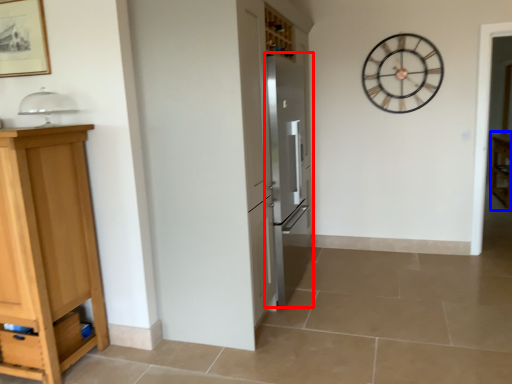
Question: Which point is further to the camera, appliance (highlighted by a red box) or cabinetry (highlighted by a blue box)?

Choices:
 (A) appliance
 (B) cabinetry

Answer: (B)